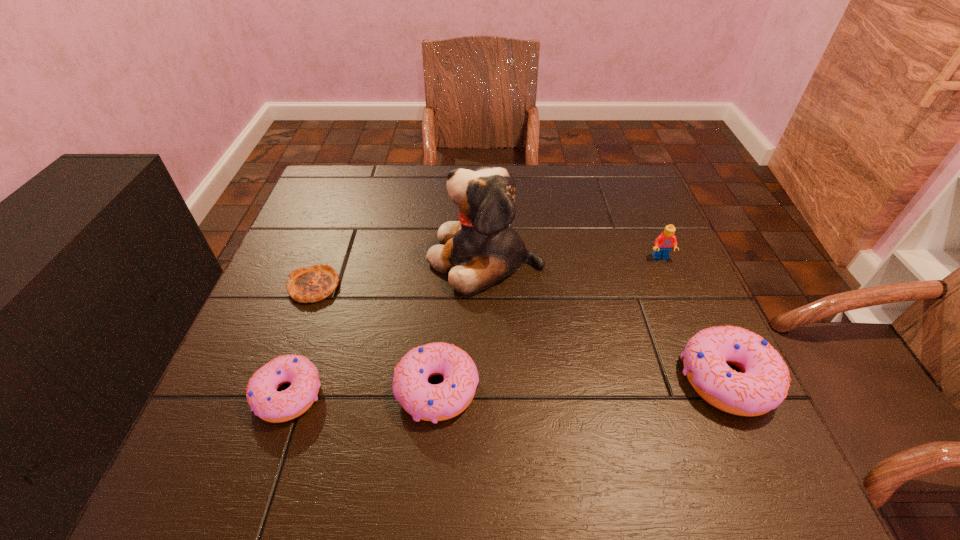
This screenshot has height=540, width=960. In order to click on empty space that is in between the Lego and the rightmost doughnut in this screenshot , I will do `click(694, 318)`.

Identify the location of empty space between the leftmost doughnut and the tallest object. (387, 326).

Image resolution: width=960 pixels, height=540 pixels. In order to click on free space between the second shortest doughnut and the quiche in this screenshot , I will do `click(375, 338)`.

You are a GUI agent. You are given a task and a screenshot of the screen. Output one action in this format:
    pyautogui.click(x=<x>, y=<y>)
    Task: Click on the vacant area that lies between the tallest object and the rightmost doughnut
    
    Given the screenshot: What is the action you would take?
    pyautogui.click(x=606, y=318)

Image resolution: width=960 pixels, height=540 pixels. Identify the location of free space between the third shortest object and the tallest object. (461, 323).

Locate an element on the screen. vacant point located between the tallest object and the second shortest object is located at coordinates (387, 326).

Choose which object is the third nearest neighbor to the rightmost doughnut. Please provide its 2D coordinates. Your answer should be formatted as a tuple, i.e. [(x, y)], where the tuple contains the x and y coordinates of a point satisfying the conditions above.

[(423, 401)]

Identify which object is located as the fifth nearest to the puppy. Please provide its 2D coordinates. Your answer should be formatted as a tuple, i.e. [(x, y)], where the tuple contains the x and y coordinates of a point satisfying the conditions above.

[(665, 241)]

Identify which doughnut is the second closest to the rightmost doughnut. Please provide its 2D coordinates. Your answer should be formatted as a tuple, i.e. [(x, y)], where the tuple contains the x and y coordinates of a point satisfying the conditions above.

[(263, 398)]

Select which doughnut appears as the closest to the rightmost doughnut. Please provide its 2D coordinates. Your answer should be formatted as a tuple, i.e. [(x, y)], where the tuple contains the x and y coordinates of a point satisfying the conditions above.

[(423, 401)]